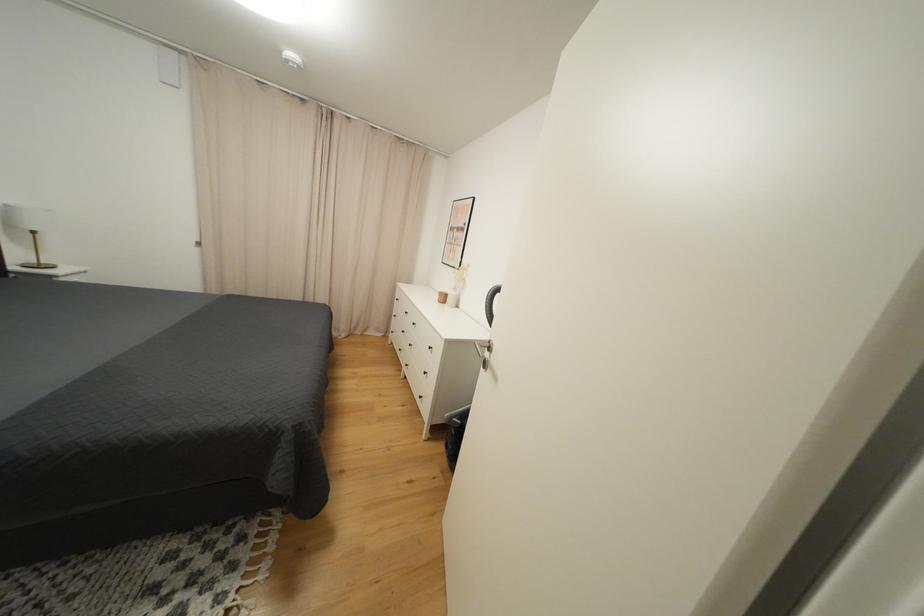
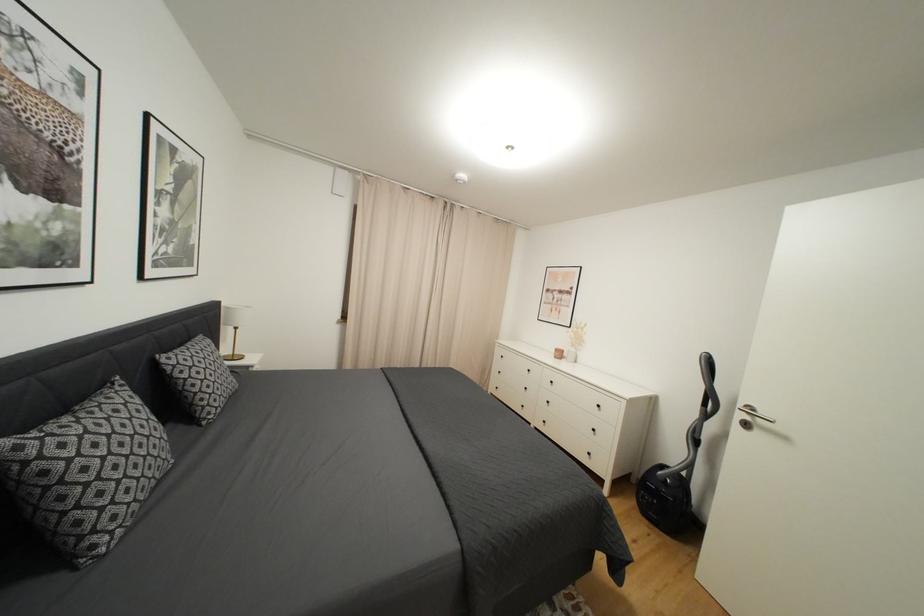
Question: In a continuous first-person perspective shot, in which direction is the camera moving?

Choices:
 (A) Left
 (B) Right
 (C) Forward
 (D) Backward

Answer: (A)